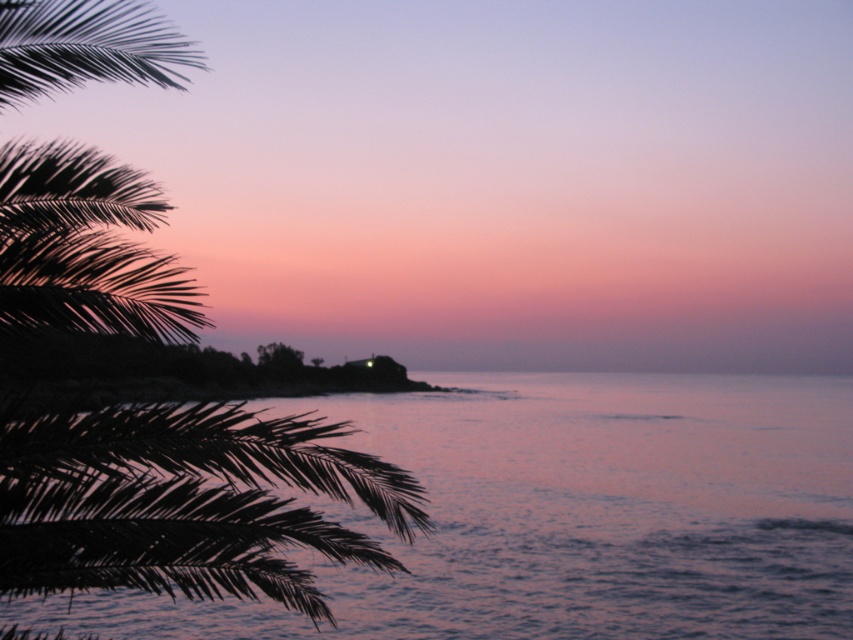
Consider the image. Which is below, purple water at center or green leafy palm tree at left?

Positioned lower is purple water at center.

Is point (808, 570) farther from viewer compared to point (375, 492)?

That is True.

The height and width of the screenshot is (640, 853). In order to click on purple water at center in this screenshot , I will do `click(569, 516)`.